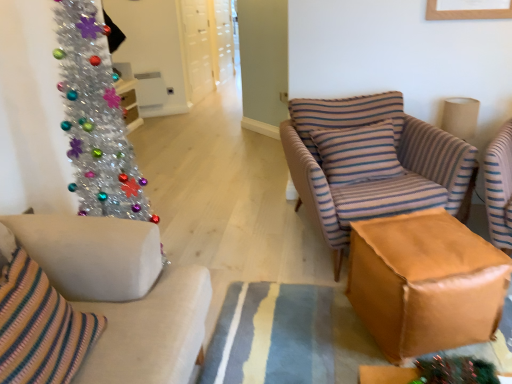
Locate an element on the screen. The width and height of the screenshot is (512, 384). free space to the left of brown leather ottoman at center is located at coordinates (305, 321).